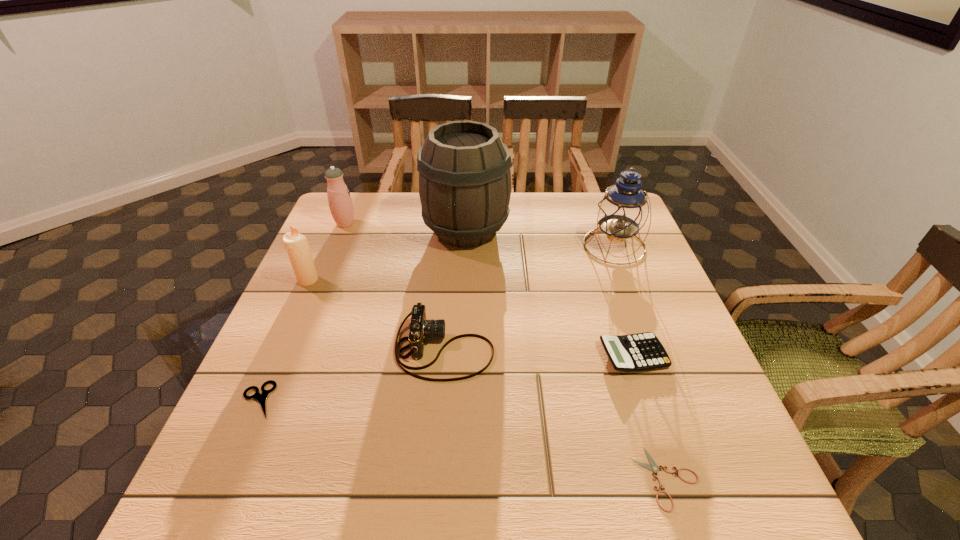
Where is `free space between the thermos bottle and the nearest object`? free space between the thermos bottle and the nearest object is located at coordinates (506, 351).

At what (x,y) coordinates should I click in order to perform the action: click on vacant space that is in between the left shears and the shorter shears. Please return your answer as a coordinate pair (x, y). The image size is (960, 540). Looking at the image, I should click on (463, 439).

Where is `empty space that is in between the shortest object and the fourth farthest object`? empty space that is in between the shortest object and the fourth farthest object is located at coordinates (488, 379).

Where is `empty space that is in between the tallest object and the second tallest object`? The height and width of the screenshot is (540, 960). empty space that is in between the tallest object and the second tallest object is located at coordinates (540, 238).

Locate an element on the screen. The width and height of the screenshot is (960, 540). free point between the candle and the fourth shortest object is located at coordinates (376, 314).

Identify which object is located as the seventh nearest to the nearest object. Please provide its 2D coordinates. Your answer should be formatted as a tuple, i.e. [(x, y)], where the tuple contains the x and y coordinates of a point satisfying the conditions above.

[(340, 203)]

The width and height of the screenshot is (960, 540). What are the coordinates of `object that is the seventh closest to the tallest object` in the screenshot? It's located at (653, 467).